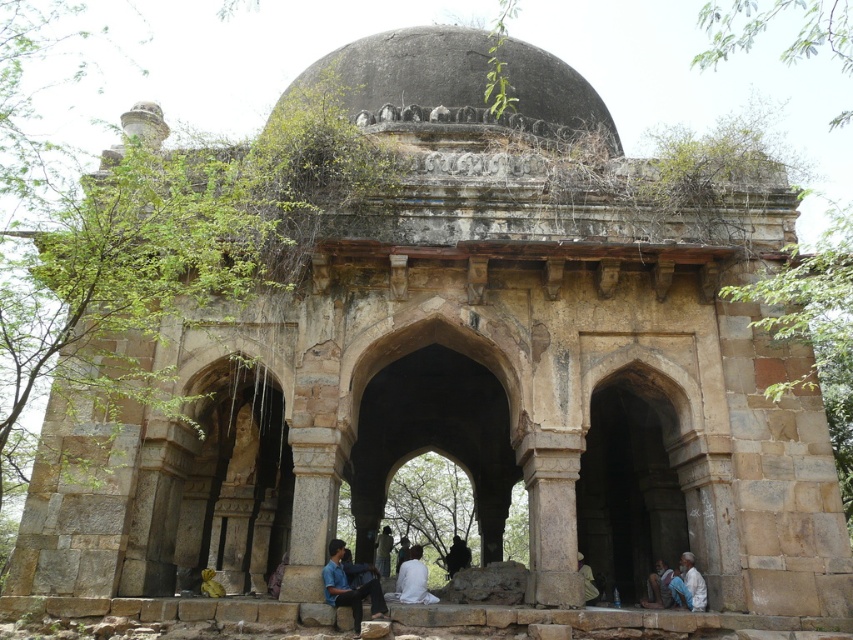
You are standing at the entrance of the ancient stone structure and see a blue shirt at lower center. What is the color of the clothing item located at point (349, 588)?

The clothing item at point (349, 588) is a blue shirt at lower center.

You are a photographer setting up a shot of the ancient stone structure. You have a light brown fabric at lower center and a dark brown leather jacket at center. Which object should you focus on first if you want to capture the widest part of the scene?

The light brown fabric at lower center should be focused on first because its width surpasses that of the dark brown leather jacket at center, making it the wider object to capture the widest part of the scene.